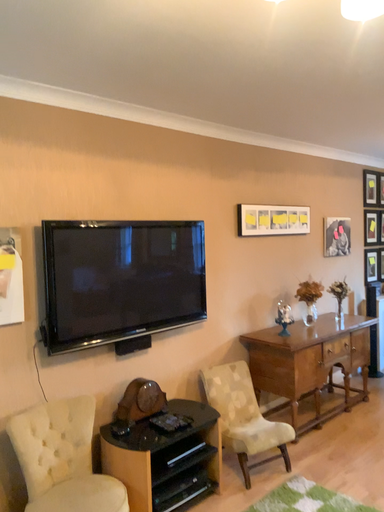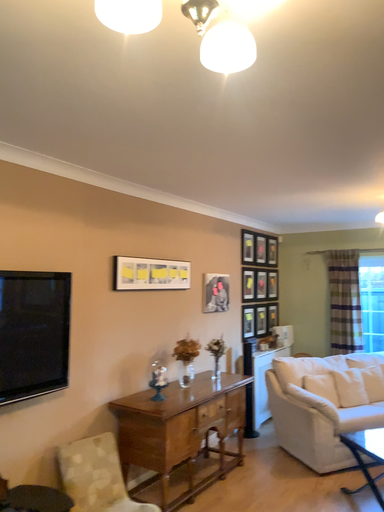
Question: Which way did the camera rotate in the video?

Choices:
 (A) rotated right
 (B) rotated left

Answer: (A)